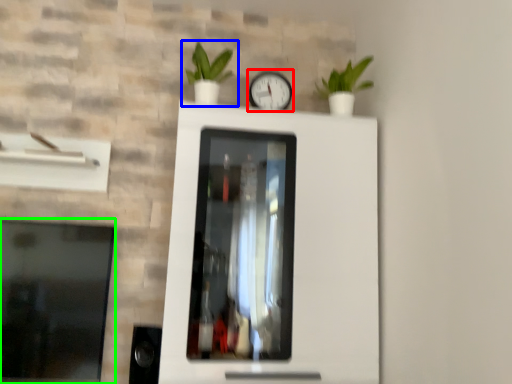
Question: Which object is the closest to the clock (highlighted by a red box)? Choose among these: houseplant (highlighted by a blue box) or window (highlighted by a green box).

Choices:
 (A) houseplant
 (B) window

Answer: (A)